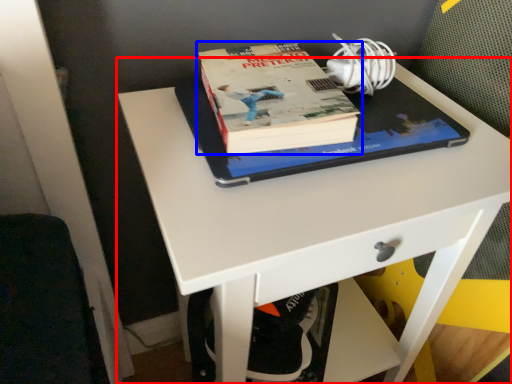
Question: Among these objects, which one is farthest to the camera, desk (highlighted by a red box) or book (highlighted by a blue box)?

Choices:
 (A) desk
 (B) book

Answer: (B)